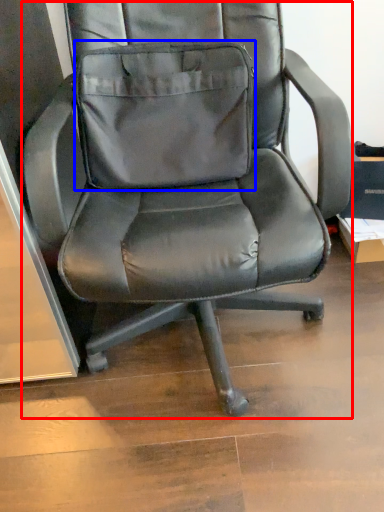
Question: Which point is further to the camera, chair (highlighted by a red box) or pocket (highlighted by a blue box)?

Choices:
 (A) chair
 (B) pocket

Answer: (B)